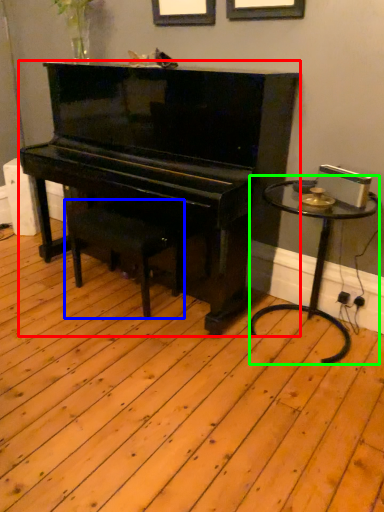
Question: Which object is positioned closest to piano (highlighted by a red box)? Select from music stool (highlighted by a blue box) and table (highlighted by a green box).

Choices:
 (A) music stool
 (B) table

Answer: (A)